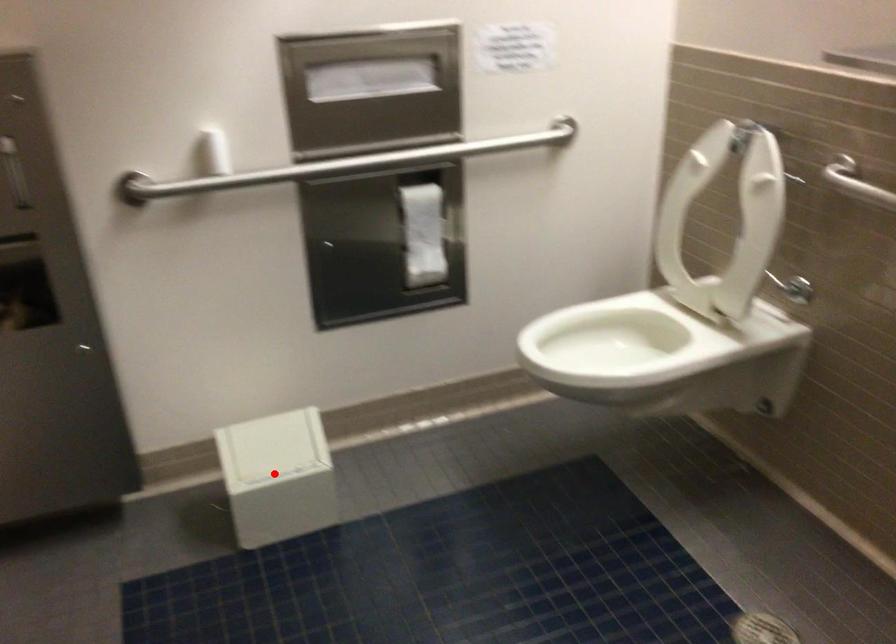
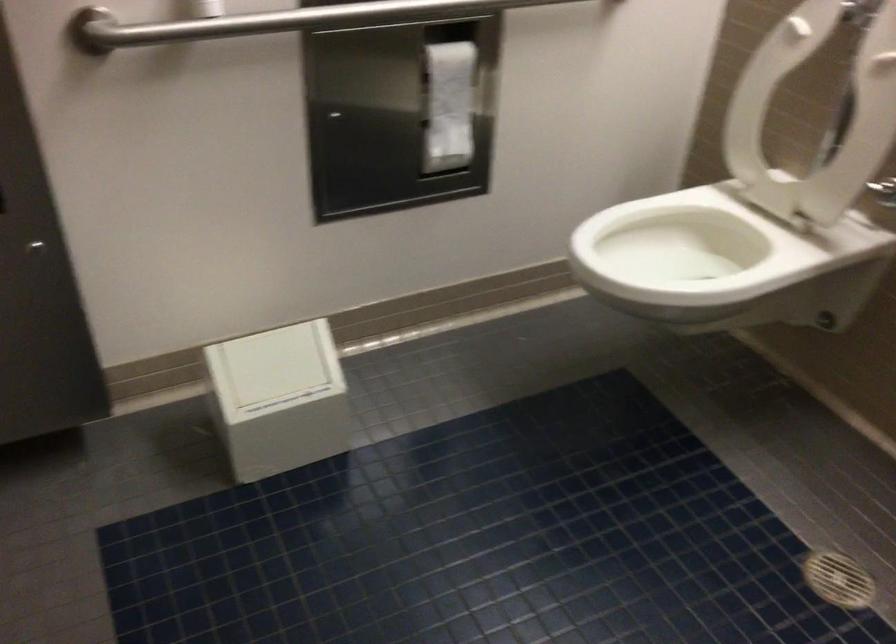
Question: I am providing you with two images of the same scene from different viewpoints. Image1 has a red point marked. In image2, the corresponding 3D location appears at what relative position? Reply with the corresponding letter.

Choices:
 (A) Closer
 (B) Farther

Answer: (A)